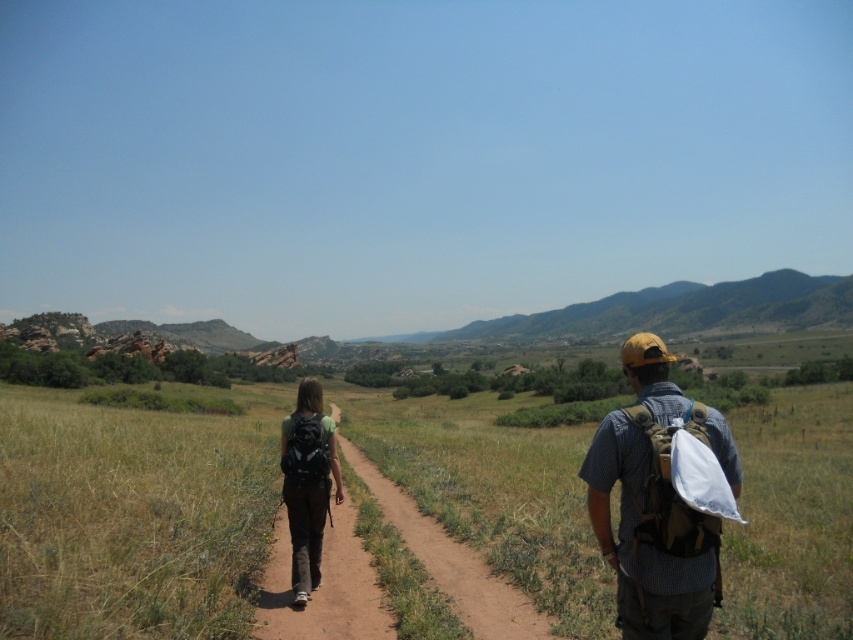
Measure the distance from tan canvas backpack at right to matte black backpack at center.

The distance of tan canvas backpack at right from matte black backpack at center is 5.80 meters.

Between tan canvas backpack at right and matte black backpack at center, which one has more height?

tan canvas backpack at right is taller.

What do you see at coordinates (668, 499) in the screenshot? Image resolution: width=853 pixels, height=640 pixels. I see `tan canvas backpack at right` at bounding box center [668, 499].

This screenshot has height=640, width=853. Find the location of `tan canvas backpack at right`. tan canvas backpack at right is located at coordinates (668, 499).

Is green grassy at center taller than brown dirt path at center?

Yes, green grassy at center is taller than brown dirt path at center.

Is green grassy at center below brown dirt path at center?

Incorrect, green grassy at center is not positioned below brown dirt path at center.

The image size is (853, 640). What do you see at coordinates (131, 516) in the screenshot? I see `green grassy at center` at bounding box center [131, 516].

The height and width of the screenshot is (640, 853). What are the coordinates of `green grassy at center` in the screenshot? It's located at (131, 516).

Measure the distance between point (x=642, y=477) and camera.

The distance of point (x=642, y=477) from camera is 22.36 feet.

Can you confirm if matte khaki cap at upper right is wider than matte black backpack at center?

Incorrect, matte khaki cap at upper right's width does not surpass matte black backpack at center's.

Is point (693, 600) positioned before point (309, 460)?

Yes, point (693, 600) is in front of point (309, 460).

Where is `matte khaki cap at upper right`? Image resolution: width=853 pixels, height=640 pixels. matte khaki cap at upper right is located at coordinates (662, 499).